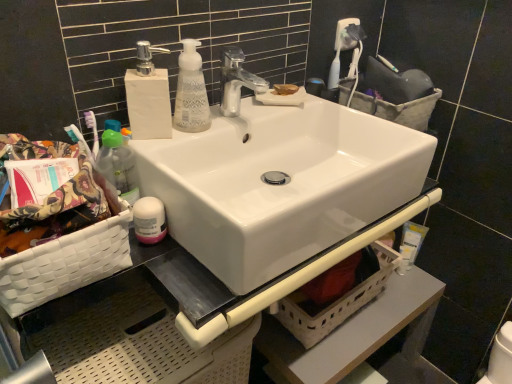
I want to click on free space in front of white plastic lotion at right, which is counted as the 2th toiletry, starting from the front, so click(x=401, y=297).